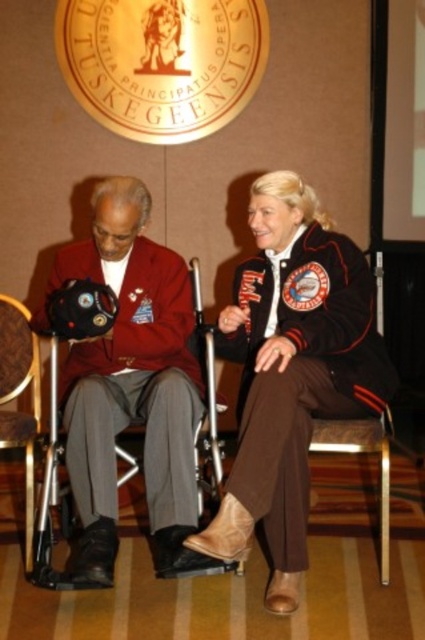
Can you confirm if matte black helmet at center is positioned above brown leather chair at lower left?

Yes.

Is matte black helmet at center below brown leather chair at lower left?

Incorrect, matte black helmet at center is not positioned below brown leather chair at lower left.

Which is behind, point (82, 499) or point (10, 444)?

Positioned behind is point (10, 444).

The width and height of the screenshot is (425, 640). In order to click on matte black helmet at center in this screenshot , I will do `click(132, 387)`.

Can you confirm if matte black jacket at center is shorter than matte black helmet at center?

No, matte black jacket at center is not shorter than matte black helmet at center.

In the scene shown: Is matte black jacket at center above matte black helmet at center?

No.

Between point (76, 413) and point (172, 257), which one is positioned behind?

The point (172, 257) is more distant.

Where is `matte black jacket at center`? matte black jacket at center is located at coordinates (291, 371).

Does matte black jacket at center appear on the right side of brown leather chair at lower left?

Indeed, matte black jacket at center is positioned on the right side of brown leather chair at lower left.

Image resolution: width=425 pixels, height=640 pixels. Describe the element at coordinates (291, 371) in the screenshot. I see `matte black jacket at center` at that location.

Describe the element at coordinates (291, 371) in the screenshot. I see `matte black jacket at center` at that location.

Locate an element on the screen. matte black jacket at center is located at coordinates (291, 371).